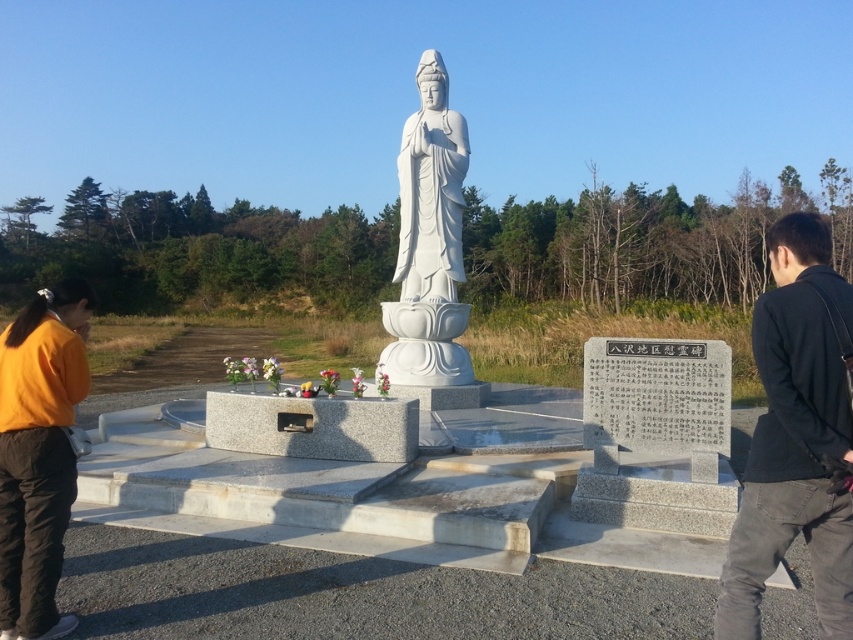
You are a visitor at the statue and want to place a flower offering on the altar. You notice the black cotton jacket at right and the white marble statue at center. Which object is closer to the altar?

The black cotton jacket at right is in front of the white marble statue at center, so it is closer to the altar.

You are a visitor at the statue and want to place an offering on the orange fabric at lower left. Can you reach it without moving the white marble statue at center?

The orange fabric at lower left is positioned under the white marble statue at center, so it is not accessible without moving the statue.

You are a visitor at the statue and want to place a flower offering on the altar. You have a black cotton jacket at right and an orange fabric at lower left. Which item is closer to the altar?

The black cotton jacket at right is located below orange fabric at lower left, so the black cotton jacket at right is closer to the altar.